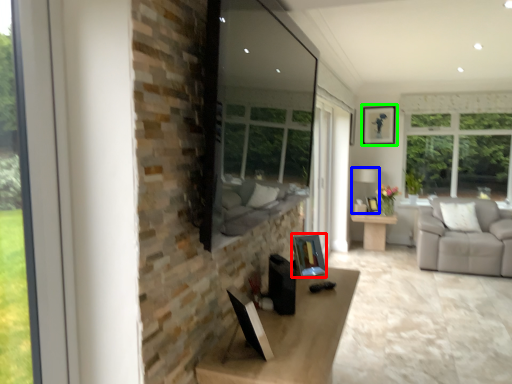
Question: Estimate the real-world distances between objects in this image. Which object is closer to picture frame (highlighted by a red box), lamp (highlighted by a blue box) or picture frame (highlighted by a green box)?

Choices:
 (A) lamp
 (B) picture frame

Answer: (A)